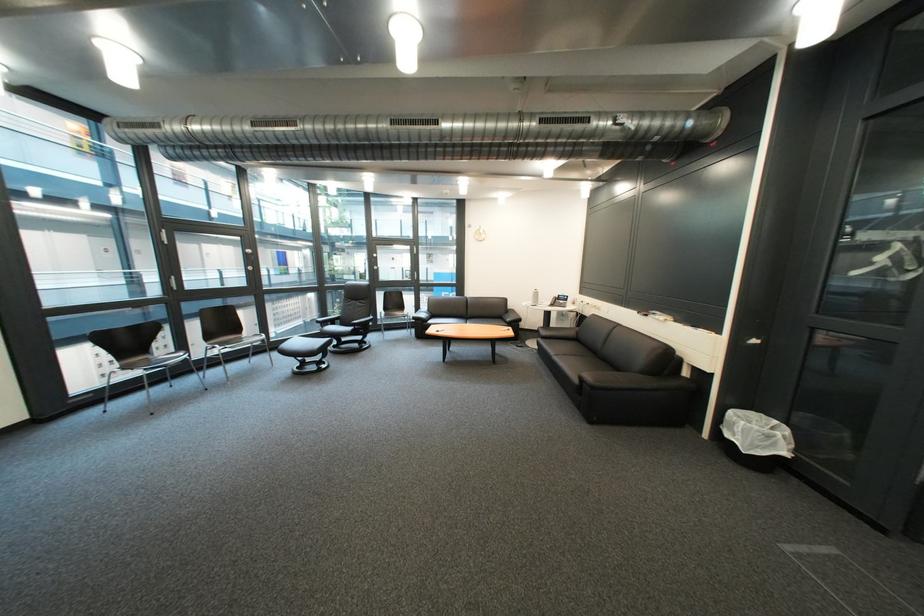
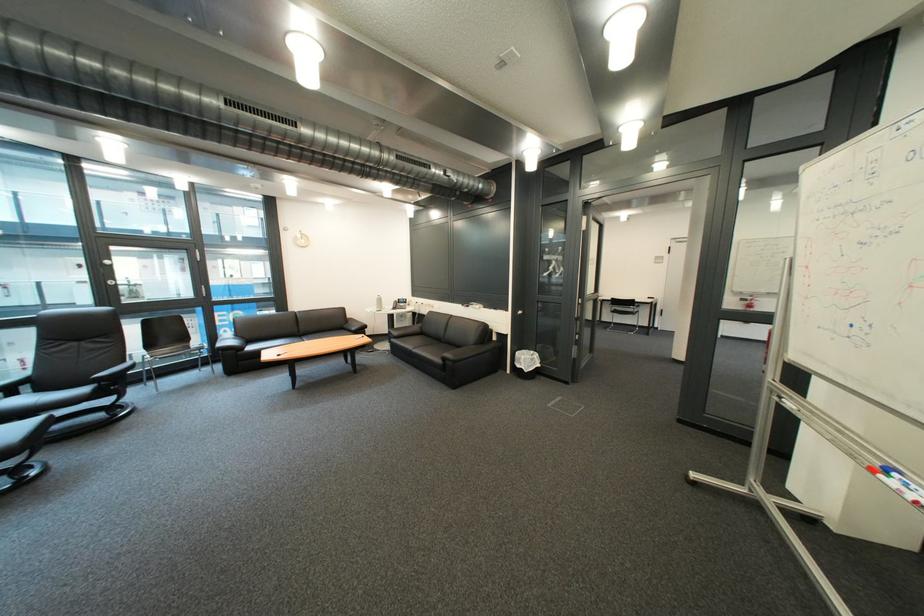
Where in the second image is the point corresponding to pixel 751 431 from the first image?

(536, 363)